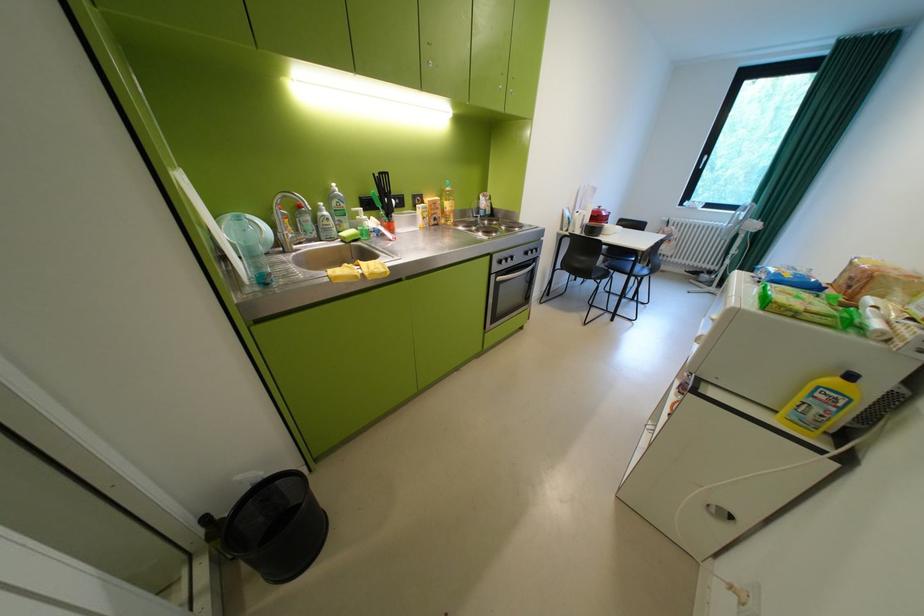
Where would you pull the freezer door handle? Please return your answer as a coordinate pair (x, y).

(910, 400)